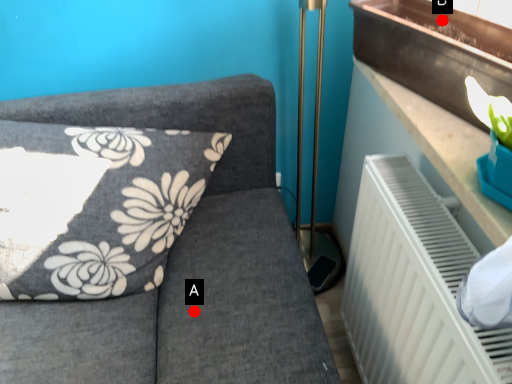
Question: Two points are circled on the image, labeled by A and B beside each circle. Which point is further to the camera?

Choices:
 (A) A is further
 (B) B is further

Answer: (A)